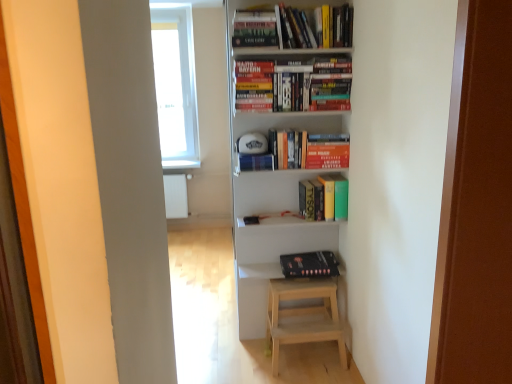
Question: Based on their sizes in the image, would you say hardcover books at upper center, which is counted as the first book, starting from the top, is bigger or smaller than transparent plastic window sill at upper center?

Choices:
 (A) small
 (B) big

Answer: (B)

Question: From a real-world perspective, is hardcover books at upper center, the 4th book from the bottom, positioned above or below transparent plastic window sill at upper center?

Choices:
 (A) below
 (B) above

Answer: (B)

Question: Considering the real-world distances, which object is farthest from the hardcover book at center, positioned as the third book in top-to-bottom order?

Choices:
 (A) hardcover book at upper center
 (B) hardcover books at upper center, marked as the 2th book in a top-to-bottom arrangement
 (C) white matte bookcase at center
 (D) black matte book at lower center, which appears as the 4th book when viewed from the top
 (E) transparent plastic window sill at upper center

Answer: (E)

Question: Considering the real-world distances, which object is closest to the transparent plastic window sill at upper center?

Choices:
 (A) hardcover books at upper center, which is the 3th book from bottom to top
 (B) black matte book at lower center, which appears as the 4th book when viewed from the top
 (C) hardcover books at upper center, which is counted as the first book, starting from the top
 (D) hardcover book at center, positioned as the third book in top-to-bottom order
 (E) hardcover book at upper center

Answer: (B)